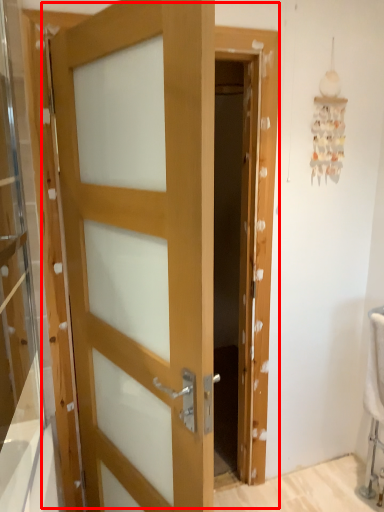
Question: Observing the image, what is the correct spatial positioning of door (annotated by the red box) in reference to glass door?

Choices:
 (A) left
 (B) right

Answer: (B)